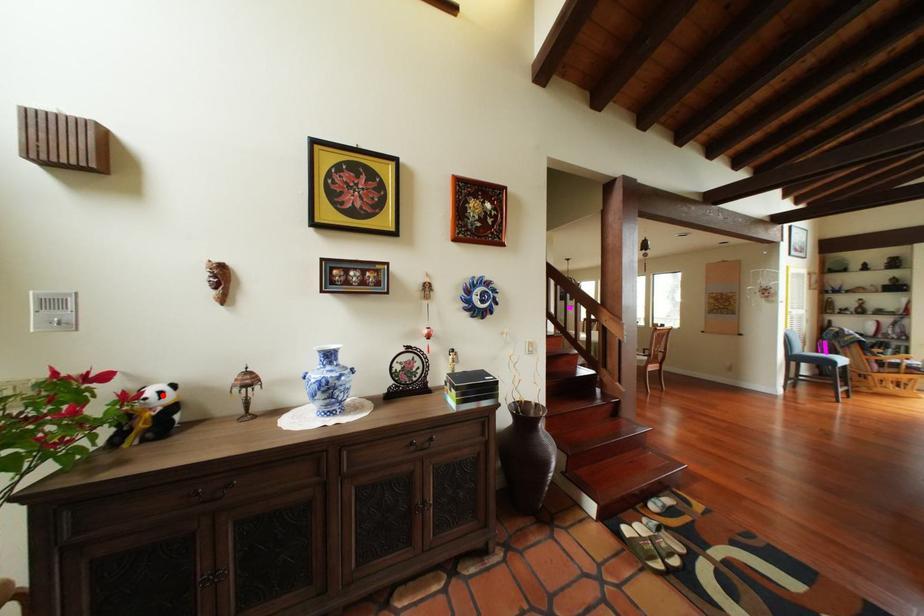
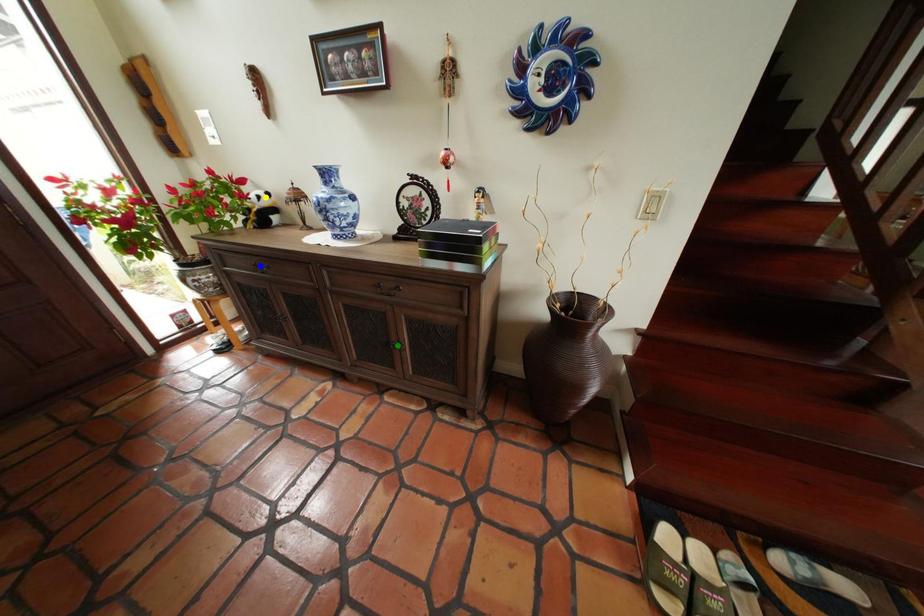
Question: I am providing you with two images of the same scene from different viewpoints. A red point is marked on the first image. You are given multiple points on the second image. Which spot in image 2 lines up with the point in image 1?

Choices:
 (A) blue point
 (B) green point
 (C) yellow point

Answer: (C)